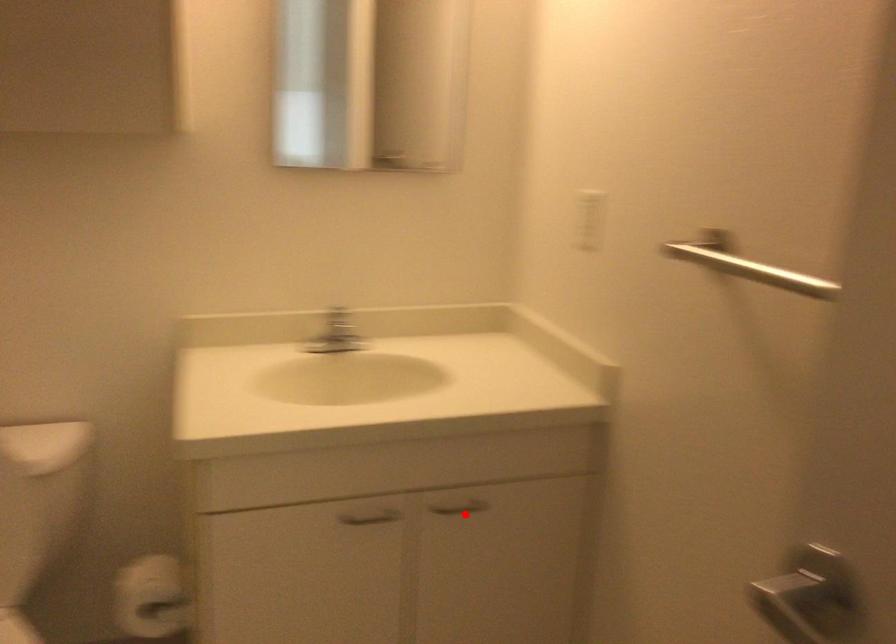
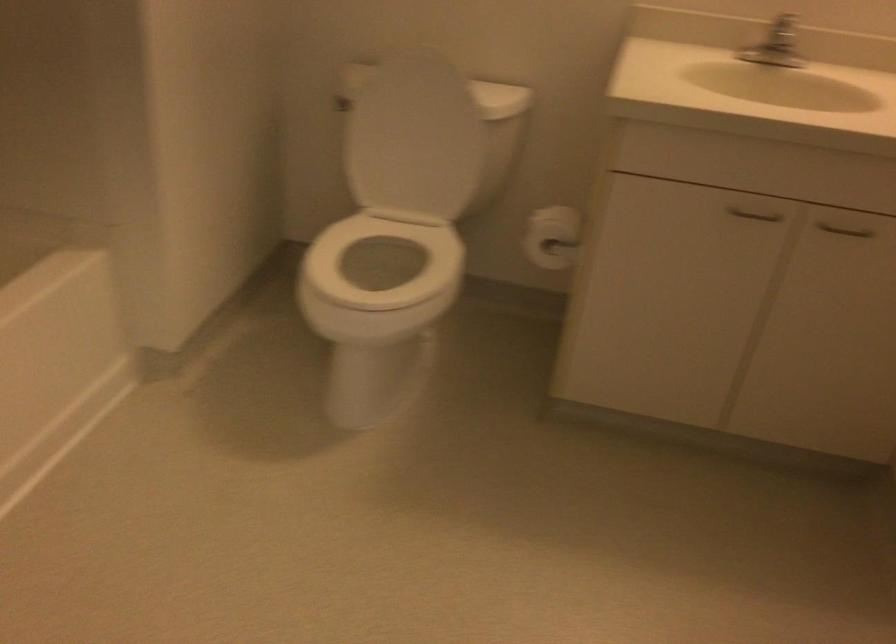
In the second image, find the point that corresponds to the highlighted location in the first image.

(845, 230)